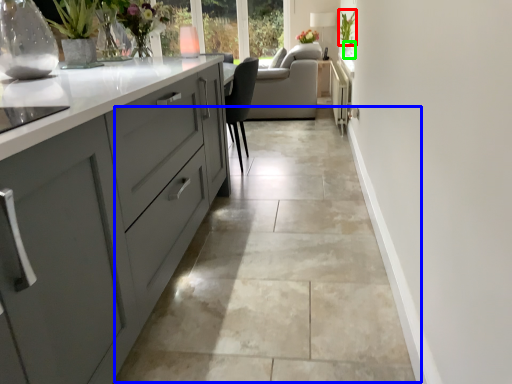
Question: Which object is the farthest from plant (highlighted by a red box)? Choose among these: concrete (highlighted by a blue box) or glass vase (highlighted by a green box).

Choices:
 (A) concrete
 (B) glass vase

Answer: (A)